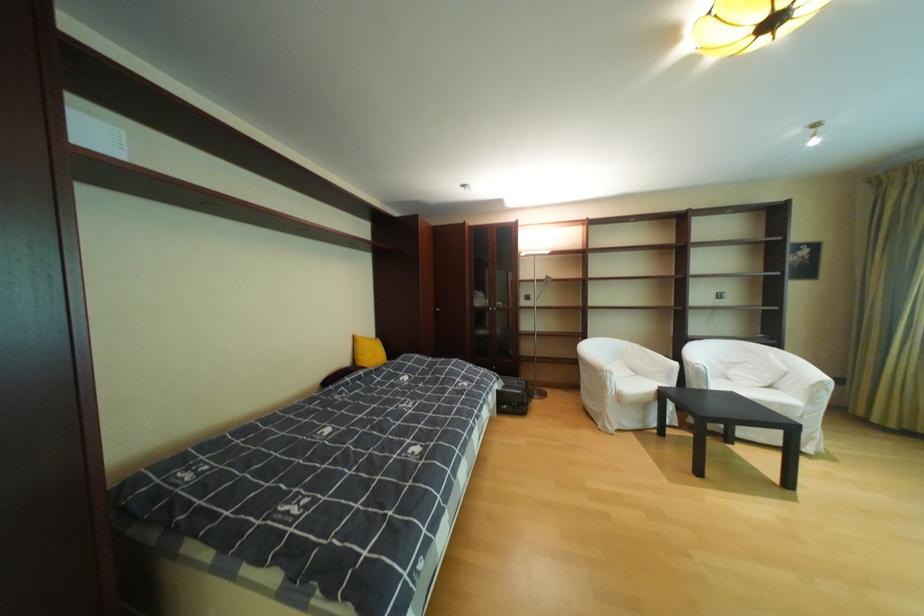
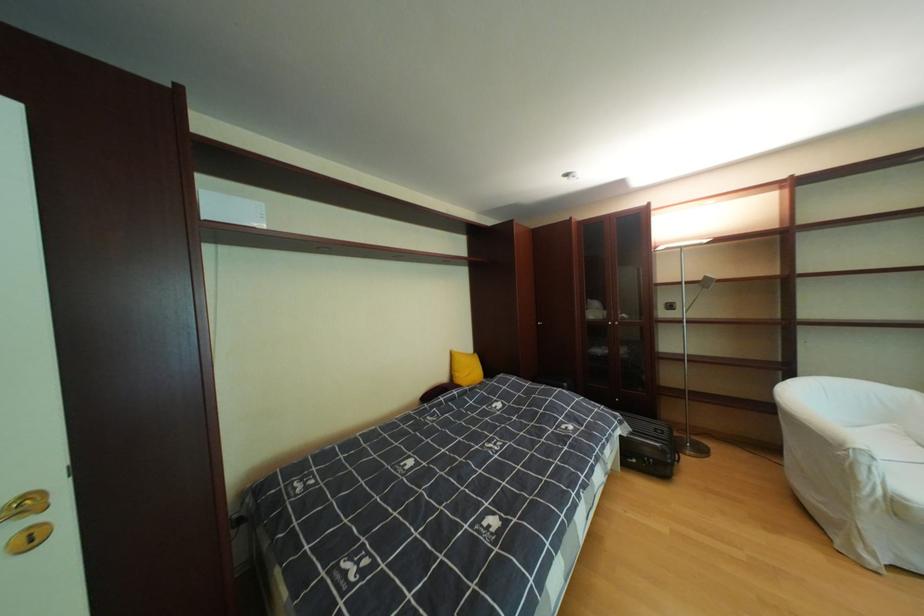
Locate, in the second image, the point that corresponds to [630,397] in the first image.

(908, 506)